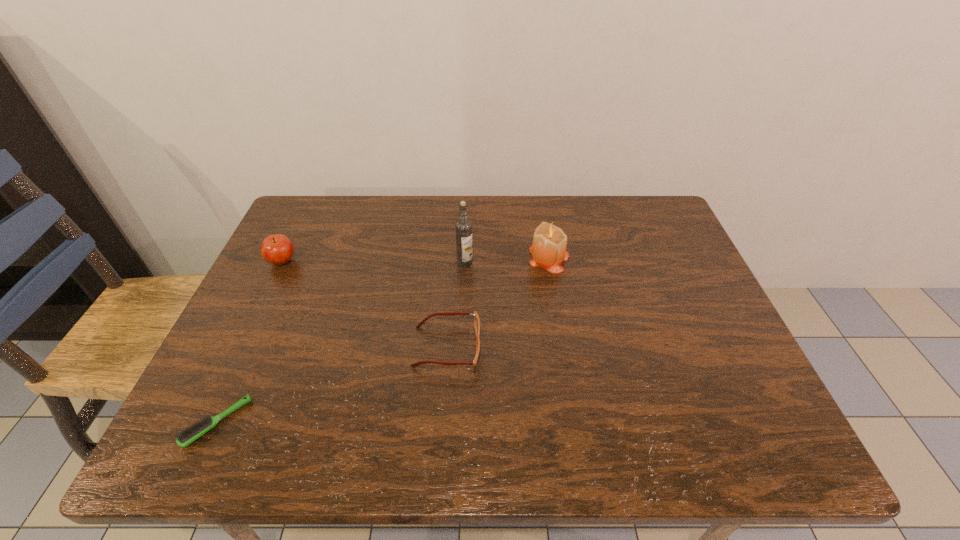
At what (x,y) coordinates should I click in order to perform the action: click on vodka. Please return your answer as a coordinate pair (x, y). Image resolution: width=960 pixels, height=540 pixels. Looking at the image, I should click on (463, 227).

Where is `candle`? This screenshot has height=540, width=960. candle is located at coordinates (548, 250).

I want to click on the rightmost object, so click(x=548, y=250).

Find the location of a particular element. The image size is (960, 540). apple is located at coordinates (277, 249).

This screenshot has height=540, width=960. I want to click on spectacles, so click(476, 318).

The height and width of the screenshot is (540, 960). I want to click on the fourth tallest object, so click(x=476, y=318).

Identify the location of hairbrush. (192, 433).

Locate an element on the screen. the shortest object is located at coordinates (192, 433).

The height and width of the screenshot is (540, 960). In order to click on free space located on the label of the vodka in this screenshot , I will do `click(463, 312)`.

You are a GUI agent. You are given a task and a screenshot of the screen. Output one action in this format:
    pyautogui.click(x=<x>, y=<y>)
    Task: Click on the vacant area situated on the back of the candle
    
    Given the screenshot: What is the action you would take?
    pyautogui.click(x=540, y=200)